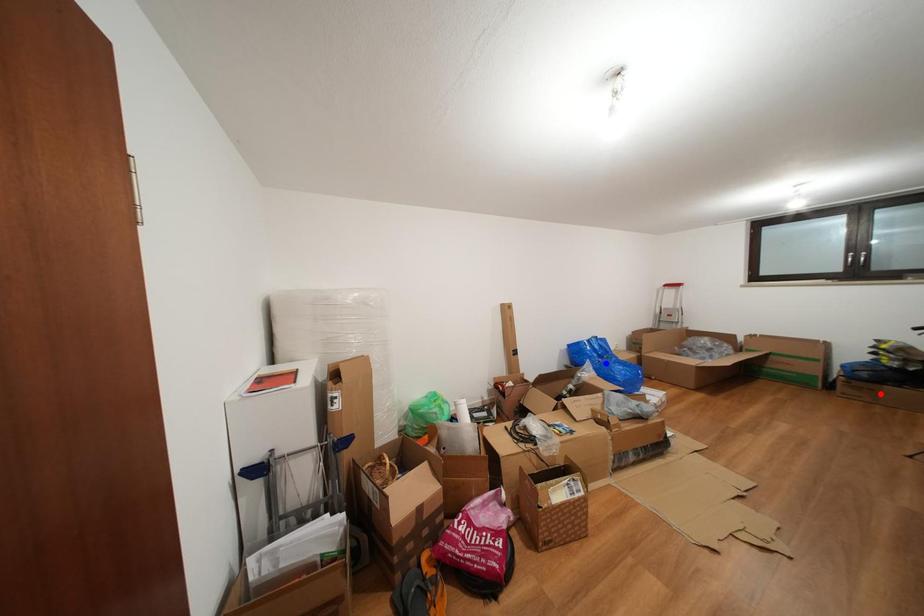
Question: Two points are marked on the image. Which point is closer to the camera?

Choices:
 (A) Blue point is closer.
 (B) Red point is closer.

Answer: (B)